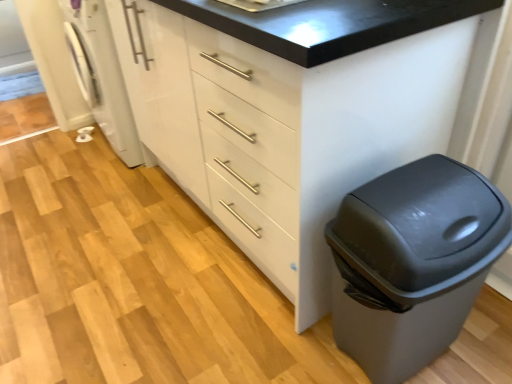
Locate an element on the screen. The image size is (512, 384). matte gray trash can at lower right is located at coordinates (413, 262).

At what (x,y) coordinates should I click in order to perform the action: click on white glossy washing machine at left. Please return your answer as a coordinate pair (x, y). The image size is (512, 384). Looking at the image, I should click on (101, 75).

Is white glossy cabinet at center wider or thinner than matte gray trash can at lower right?

white glossy cabinet at center is wider than matte gray trash can at lower right.

Which point is more forward, [269,123] or [339,216]?

The point [269,123] is closer to the camera.

Considering the positions of objects white glossy cabinet at center and matte gray trash can at lower right in the image provided, who is more to the right, white glossy cabinet at center or matte gray trash can at lower right?

From the viewer's perspective, matte gray trash can at lower right appears more on the right side.

Considering the relative positions of white glossy cabinet at center and matte gray trash can at lower right in the image provided, is white glossy cabinet at center in front of matte gray trash can at lower right?

Yes, white glossy cabinet at center is in front of matte gray trash can at lower right.

From the image's perspective, is white glossy washing machine at left below white glossy cabinet at center?

Incorrect, from the image's perspective, white glossy washing machine at left is higher than white glossy cabinet at center.

From a real-world perspective, which object stands above the other?

From a 3D spatial view, white glossy cabinet at center is above.

This screenshot has width=512, height=384. I want to click on chest of drawers above the white glossy washing machine at left (from a real-world perspective), so click(291, 112).

How different are the orientations of matte gray trash can at lower right and white glossy cabinet at center in degrees?

The angular difference between matte gray trash can at lower right and white glossy cabinet at center is 87.4 degrees.

Is matte gray trash can at lower right aimed at white glossy cabinet at center?

No, matte gray trash can at lower right is not oriented towards white glossy cabinet at center.

From the image's perspective, between matte gray trash can at lower right and white glossy cabinet at center, which one is located above?

white glossy cabinet at center appears higher in the image.

From a real-world perspective, between matte gray trash can at lower right and white glossy cabinet at center, who is vertically lower?

matte gray trash can at lower right, from a real-world perspective.

Considering the relative sizes of matte gray trash can at lower right and white glossy washing machine at left in the image provided, is matte gray trash can at lower right wider than white glossy washing machine at left?

No.

Is white glossy washing machine at left a part of matte gray trash can at lower right?

No, matte gray trash can at lower right does not contain white glossy washing machine at left.

From the image's perspective, does matte gray trash can at lower right appear higher than white glossy washing machine at left?

Incorrect, from the image's perspective, matte gray trash can at lower right is lower than white glossy washing machine at left.

Is matte gray trash can at lower right at the right side of white glossy washing machine at left?

Indeed, matte gray trash can at lower right is positioned on the right side of white glossy washing machine at left.

What's the angular difference between white glossy washing machine at left and matte gray trash can at lower right's facing directions?

The angle between the facing direction of white glossy washing machine at left and the facing direction of matte gray trash can at lower right is 86 degrees.

Image resolution: width=512 pixels, height=384 pixels. What are the coordinates of `washing machine on the left of matte gray trash can at lower right` in the screenshot? It's located at (101, 75).

Is white glossy washing machine at left at the left side of matte gray trash can at lower right?

Indeed, white glossy washing machine at left is positioned on the left side of matte gray trash can at lower right.

Between point (123, 127) and point (396, 268), which one is positioned behind?

The point (123, 127) is behind.

From the image's perspective, is white glossy cabinet at center located above or below white glossy washing machine at left?

Based on their image positions, white glossy cabinet at center is located beneath white glossy washing machine at left.

Is white glossy cabinet at center in contact with white glossy washing machine at left?

No, white glossy cabinet at center is not with white glossy washing machine at left.

Is white glossy washing machine at left completely or partially inside white glossy cabinet at center?

No.

Identify the location of waste container on the right of white glossy cabinet at center. The image size is (512, 384). (413, 262).

Identify the location of the chest of drawers in front of the white glossy washing machine at left. This screenshot has width=512, height=384. (291, 112).

Estimate the real-world distances between objects in this image. Which object is closer to white glossy cabinet at center, matte gray trash can at lower right or white glossy washing machine at left?

Among the two, matte gray trash can at lower right is located nearer to white glossy cabinet at center.

Which object lies further to the anchor point matte gray trash can at lower right, white glossy washing machine at left or white glossy cabinet at center?

white glossy washing machine at left lies further to matte gray trash can at lower right than the other object.

Considering their positions, is white glossy cabinet at center positioned further to white glossy washing machine at left than matte gray trash can at lower right?

Based on the image, matte gray trash can at lower right appears to be further to white glossy washing machine at left.

Based on their spatial positions, is white glossy washing machine at left or matte gray trash can at lower right further from white glossy cabinet at center?

white glossy washing machine at left is further to white glossy cabinet at center.

Looking at the image, which one is located closer to white glossy washing machine at left, matte gray trash can at lower right or white glossy cabinet at center?

white glossy cabinet at center.

Considering their positions, is white glossy cabinet at center positioned further to matte gray trash can at lower right than white glossy washing machine at left?

Among the two, white glossy washing machine at left is located further to matte gray trash can at lower right.

Where is `the chest of drawers situated between white glossy washing machine at left and matte gray trash can at lower right from left to right`? the chest of drawers situated between white glossy washing machine at left and matte gray trash can at lower right from left to right is located at coordinates (291, 112).